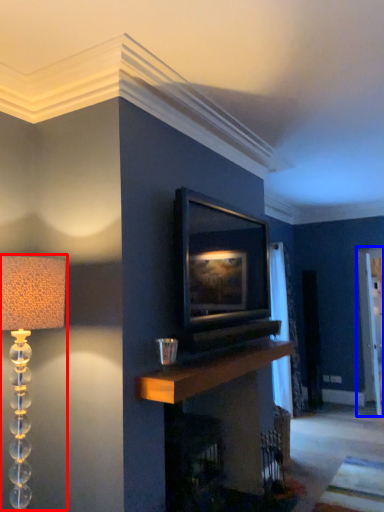
Question: Among these objects, which one is farthest to the camera, lamp (highlighted by a red box) or glass door (highlighted by a blue box)?

Choices:
 (A) lamp
 (B) glass door

Answer: (B)